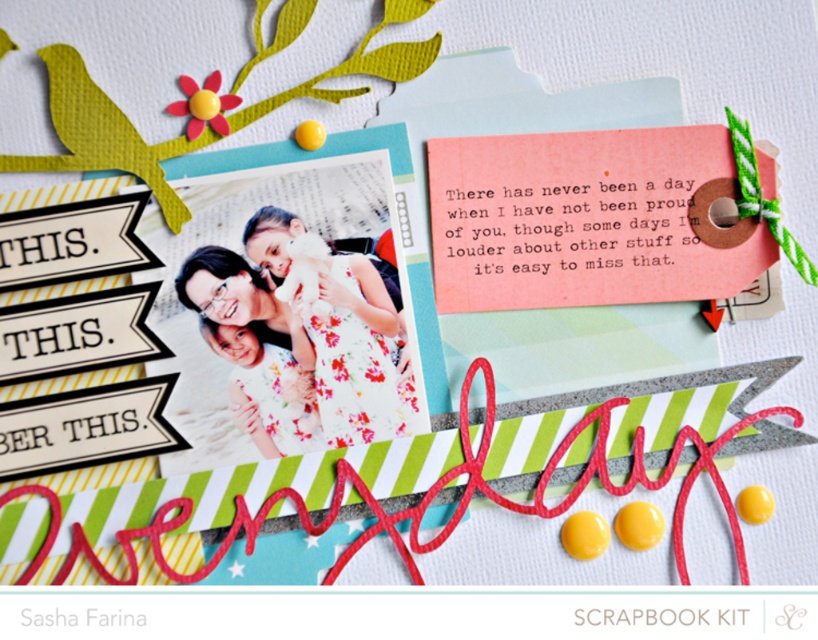
In the scene shown: You are designing a scrapbook and want to place a sticker between the pink paper tag at upper right and the floral fabric dress at center. Which object should the sticker be placed closer to if you want it to be near the smaller object?

The floral fabric dress at center is smaller than the pink paper tag at upper right, so the sticker should be placed closer to the floral fabric dress at center to be near the smaller object.

You are creating a scrapbook and want to place a sticker to the left of the floral fabric dress at center. Can you place it to the left of the pink paper tag at upper right?

The pink paper tag at upper right is to the right of the floral fabric dress at center, so placing a sticker to the left of the pink paper tag at upper right would also be to the left of the floral fabric dress at center. Yes, you can place the sticker there.

You are designing a scrapbook layout and need to ensure that the pink paper tag at upper right and the floral fabric dress at center are visible. Given their sizes, which object might require more space vertically to be fully displayed?

The floral fabric dress at center requires more vertical space since it has a greater height than the pink paper tag at upper right.